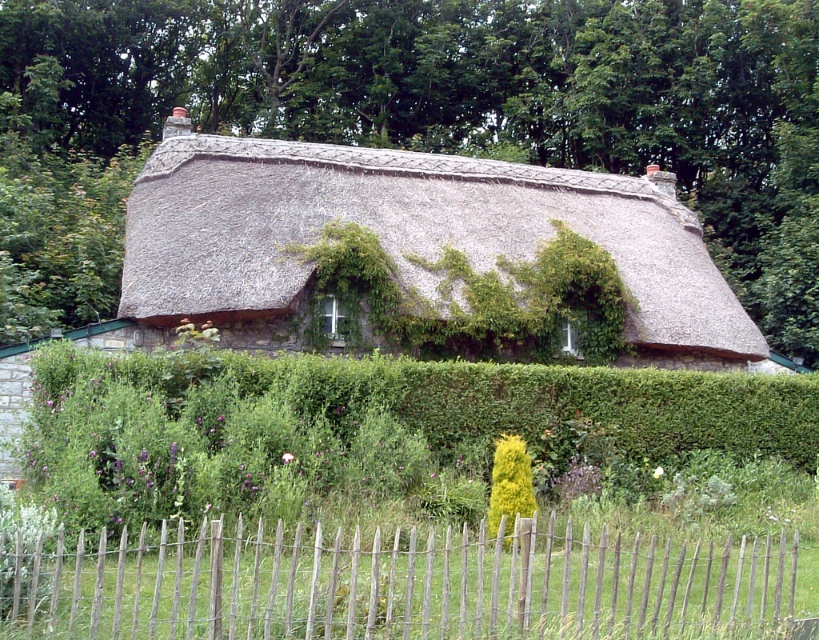
You are standing in a garden and see the green leafy hedge at center. If you want to water it using a standard garden hose that can reach up to 10 meters, will you be able to water the hedge without moving closer?

The green leafy hedge at center is 12.60 meters away from the viewer. Since the hose can only reach up to 10 meters, you will need to move closer to water it.

You are a gardener who wants to plant a new row of flowers between the green leafy hedge at center and the cottage. The flower row requires 10 meters of space. Do you think there is enough space between them?

The distance between the green leafy hedge at center and the cottage is 12.60 meters, which is more than enough for the flower row requiring 10 meters of space.

You are a visitor approaching the cottage and want to see both the green leafy hedge at center and the wooden picket fence at lower center. Which one would you see first as you walk towards the cottage?

You would first see the green leafy hedge at center because the wooden picket fence at lower center is behind it.